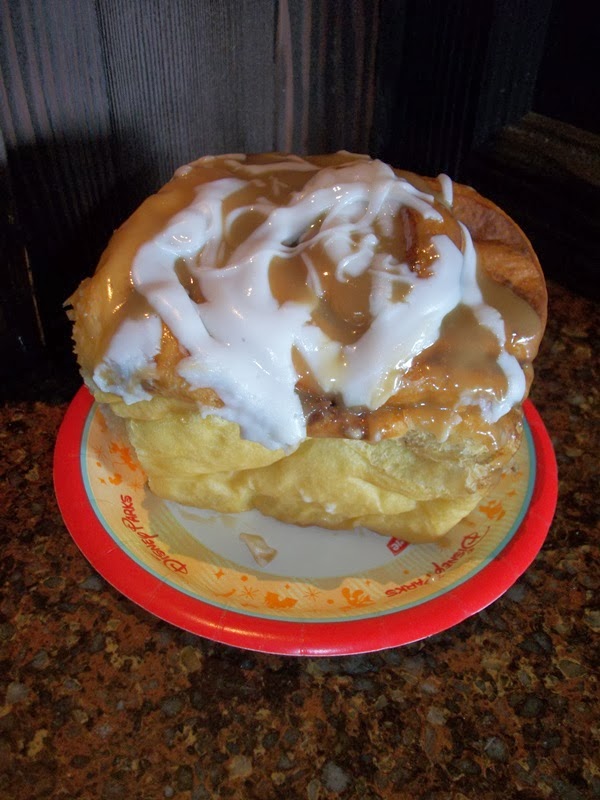
This screenshot has height=800, width=600. Identify the location of white plate. (312, 549).